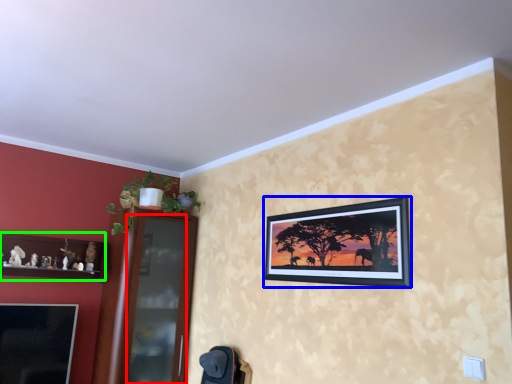
Question: Considering the real-world distances, which object is farthest from glass door (highlighted by a red box)? picture frame (highlighted by a blue box) or shelf (highlighted by a green box)?

Choices:
 (A) picture frame
 (B) shelf

Answer: (A)